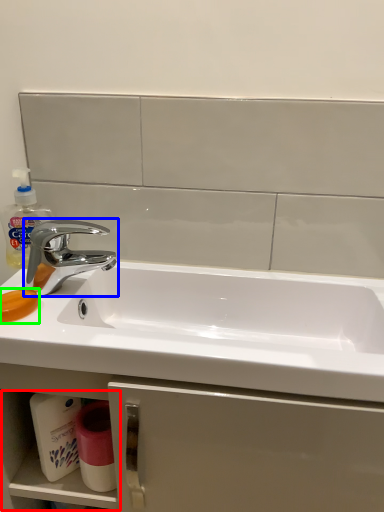
Question: Estimate the real-world distances between objects in this image. Which object is closer to shelf (highlighted by a red box), tap (highlighted by a blue box) or soap (highlighted by a green box)?

Choices:
 (A) tap
 (B) soap

Answer: (A)